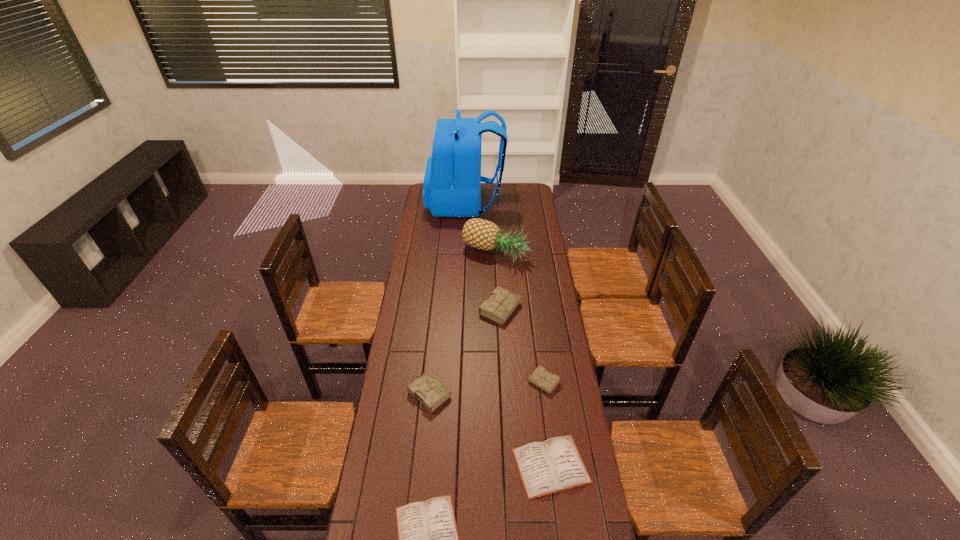
Locate an element on the screen. diary at the left edge is located at coordinates (427, 389).

At what (x,y) coordinates should I click in order to perform the action: click on pineapple present at the right edge. Please return your answer as a coordinate pair (x, y). The image size is (960, 540). Looking at the image, I should click on (481, 234).

Where is `object that is at the far left corner`? The width and height of the screenshot is (960, 540). object that is at the far left corner is located at coordinates (452, 183).

The height and width of the screenshot is (540, 960). In the image, there is a desktop. What are the coordinates of `vacant space at the far edge` in the screenshot? It's located at (493, 187).

In the image, there is a desktop. Where is `free space at the left edge`? This screenshot has height=540, width=960. free space at the left edge is located at coordinates (408, 367).

This screenshot has width=960, height=540. What are the coordinates of `vacant region at the right edge` in the screenshot? It's located at (540, 404).

Locate an element on the screen. empty space between the farthest diary and the third shortest object is located at coordinates (522, 346).

At what (x,y) coordinates should I click in order to perform the action: click on vacant region between the tallest diary and the right white diary. Please return your answer as a coordinate pair (x, y). Image resolution: width=960 pixels, height=540 pixels. Looking at the image, I should click on (526, 388).

At what (x,y) coordinates should I click in order to perform the action: click on free spot between the second smallest green diary and the bigger white diary. Please return your answer as a coordinate pair (x, y). The width and height of the screenshot is (960, 540). Looking at the image, I should click on (491, 429).

Identify the location of vacant space that is in between the fifth tallest object and the leftmost green diary. (487, 388).